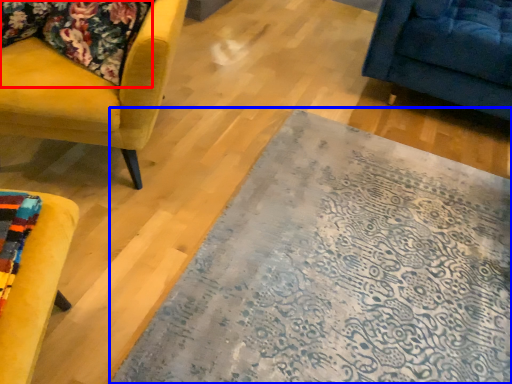
Question: Among these objects, which one is farthest to the camera, fabric (highlighted by a red box) or mat (highlighted by a blue box)?

Choices:
 (A) fabric
 (B) mat

Answer: (A)